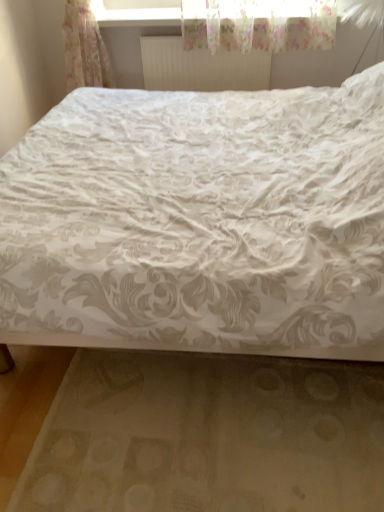
This screenshot has height=512, width=384. Find the location of `transparent plastic window frame at upper center`. transparent plastic window frame at upper center is located at coordinates (x=136, y=12).

Locate an element on the screen. white floral fabric bed at center is located at coordinates (200, 222).

Looking at this image, is white matte radiator at upper center facing towards white fabric bed frame at lower center?

Yes, white matte radiator at upper center is turned towards white fabric bed frame at lower center.

Who is shorter, white matte radiator at upper center or white fabric bed frame at lower center?

white fabric bed frame at lower center is shorter.

Considering the relative sizes of white matte radiator at upper center and white fabric bed frame at lower center in the image provided, is white matte radiator at upper center bigger than white fabric bed frame at lower center?

Actually, white matte radiator at upper center might be smaller than white fabric bed frame at lower center.

Can you confirm if white matte radiator at upper center is smaller than transparent plastic window frame at upper center?

Yes.

Which object is wider, white matte radiator at upper center or transparent plastic window frame at upper center?

With larger width is transparent plastic window frame at upper center.

From the image's perspective, is white matte radiator at upper center positioned above or below transparent plastic window frame at upper center?

white matte radiator at upper center is below transparent plastic window frame at upper center.

Is white matte radiator at upper center outside of transparent plastic window frame at upper center?

Yes, white matte radiator at upper center is not within transparent plastic window frame at upper center.

Can you tell me how much transparent plastic window frame at upper center and white floral fabric bed at center differ in facing direction?

90.3 degrees.

Which of these two, transparent plastic window frame at upper center or white floral fabric bed at center, is bigger?

white floral fabric bed at center is bigger.

Which of these two, transparent plastic window frame at upper center or white floral fabric bed at center, is wider?

With larger width is white floral fabric bed at center.

Does point (136, 13) lie in front of point (295, 342)?

No.

Can you tell me how much white fabric bed frame at lower center and white matte radiator at upper center differ in facing direction?

They differ by 2.13 degrees in their facing directions.

Where is `bed frame on the left of white matte radiator at upper center`? bed frame on the left of white matte radiator at upper center is located at coordinates (208, 435).

Does point (73, 399) come in front of point (230, 80)?

Yes.

From a real-world perspective, is transparent plastic window frame at upper center positioned under white fabric bed frame at lower center based on gravity?

No, from a real-world perspective, transparent plastic window frame at upper center is not below white fabric bed frame at lower center.

Is transparent plastic window frame at upper center to the right of white fabric bed frame at lower center from the viewer's perspective?

Yes, transparent plastic window frame at upper center is to the right of white fabric bed frame at lower center.

Does transparent plastic window frame at upper center turn towards white fabric bed frame at lower center?

→ No, transparent plastic window frame at upper center is not aimed at white fabric bed frame at lower center.

Is point (280, 11) positioned after point (175, 438)?

Yes, it is behind point (175, 438).

This screenshot has height=512, width=384. Identify the location of bed frame below the white floral fabric bed at center (from a real-world perspective). (208, 435).

Looking at this image, relative to white fabric bed frame at lower center, is white floral fabric bed at center in front or behind?

In the image, white floral fabric bed at center appears in front of white fabric bed frame at lower center.

From the image's perspective, is white floral fabric bed at center located beneath white fabric bed frame at lower center?

No, from the image's perspective, white floral fabric bed at center is not beneath white fabric bed frame at lower center.

Between white fabric bed frame at lower center and white floral fabric bed at center, which one has larger size?

Bigger between the two is white floral fabric bed at center.

Can you confirm if white fabric bed frame at lower center is shorter than white floral fabric bed at center?

Correct, white fabric bed frame at lower center is not as tall as white floral fabric bed at center.

How different are the orientations of white fabric bed frame at lower center and white floral fabric bed at center in degrees?

They differ by 89 degrees in their facing directions.

Is white fabric bed frame at lower center looking in the opposite direction of white floral fabric bed at center?

That's right, white fabric bed frame at lower center is facing away from white floral fabric bed at center.

In the image, there is a white matte radiator at upper center. Identify the location of bed frame below it (from a real-world perspective). (208, 435).

Image resolution: width=384 pixels, height=512 pixels. Find the location of `window frame lying on the right of white matte radiator at upper center`. window frame lying on the right of white matte radiator at upper center is located at coordinates (136, 12).

Considering their positions, is transparent plastic window frame at upper center positioned closer to white fabric bed frame at lower center than white matte radiator at upper center?

white matte radiator at upper center is closer to white fabric bed frame at lower center.

From the image, which object appears to be farther from white matte radiator at upper center, white floral fabric bed at center or white fabric bed frame at lower center?

The object further to white matte radiator at upper center is white fabric bed frame at lower center.

Consider the image. Considering their positions, is white matte radiator at upper center positioned closer to transparent plastic window frame at upper center than white floral fabric bed at center?

white matte radiator at upper center.

Which object lies nearer to the anchor point white fabric bed frame at lower center, white floral fabric bed at center or transparent plastic window frame at upper center?

white floral fabric bed at center is closer to white fabric bed frame at lower center.

Based on their spatial positions, is white fabric bed frame at lower center or white floral fabric bed at center closer to transparent plastic window frame at upper center?

Based on the image, white floral fabric bed at center appears to be nearer to transparent plastic window frame at upper center.

Which object lies nearer to the anchor point transparent plastic window frame at upper center, white floral fabric bed at center or white fabric bed frame at lower center?

white floral fabric bed at center lies closer to transparent plastic window frame at upper center than the other object.

Considering their positions, is white fabric bed frame at lower center positioned further to white floral fabric bed at center than white matte radiator at upper center?

white matte radiator at upper center is positioned further to the anchor white floral fabric bed at center.

Looking at the image, which one is located further to white fabric bed frame at lower center, white matte radiator at upper center or transparent plastic window frame at upper center?

transparent plastic window frame at upper center is positioned further to the anchor white fabric bed frame at lower center.

This screenshot has width=384, height=512. I want to click on bed between transparent plastic window frame at upper center and white fabric bed frame at lower center from top to bottom, so click(x=200, y=222).

You are a GUI agent. You are given a task and a screenshot of the screen. Output one action in this format:
    pyautogui.click(x=<x>, y=<y>)
    Task: Click on the radiator between transparent plastic window frame at upper center and white fabric bed frame at lower center in the up-down direction
    The height and width of the screenshot is (512, 384).
    Given the screenshot: What is the action you would take?
    pyautogui.click(x=201, y=67)

Image resolution: width=384 pixels, height=512 pixels. In order to click on window frame positioned between white floral fabric bed at center and white matte radiator at upper center from near to far in this screenshot , I will do `click(136, 12)`.

You are a GUI agent. You are given a task and a screenshot of the screen. Output one action in this format:
    pyautogui.click(x=<x>, y=<y>)
    Task: Click on the bed frame between white floral fabric bed at center and white matte radiator at upper center along the z-axis
    
    Given the screenshot: What is the action you would take?
    pyautogui.click(x=208, y=435)